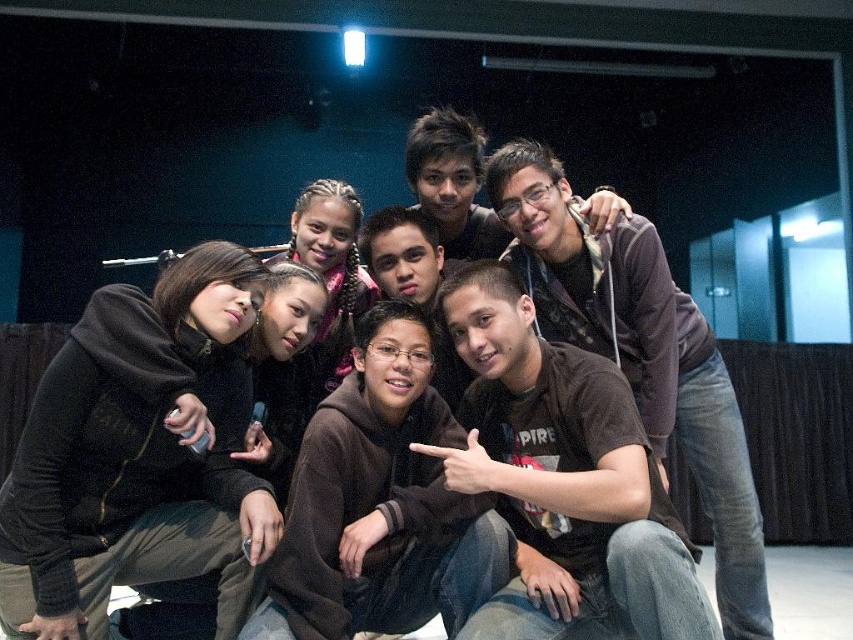
You are standing in the studio and want to grab the dark brown hoodie at lower left. Where exactly should you look to find it?

The dark brown hoodie at lower left is located at point (136, 454).